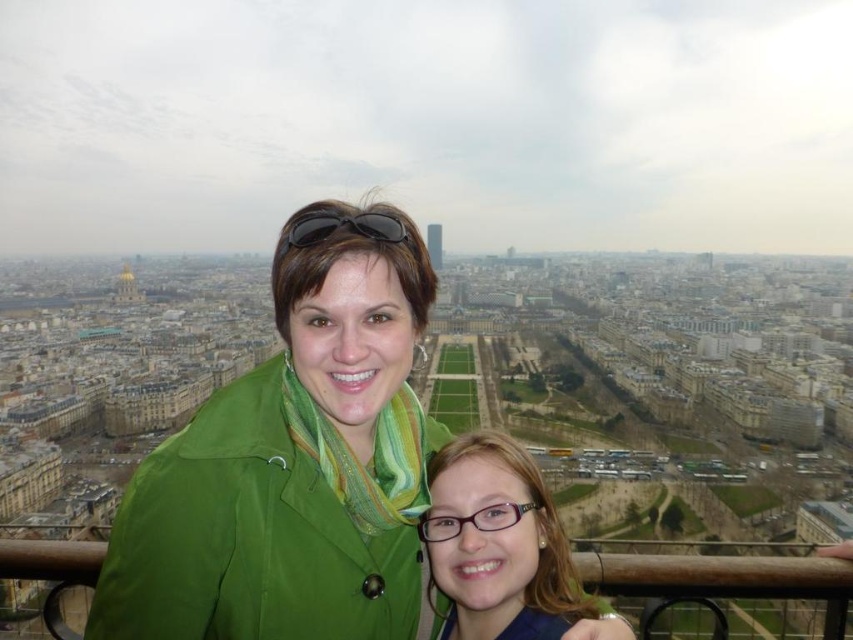
Question: Is green fabric jacket at center below black matte sunglasses at center?

Choices:
 (A) no
 (B) yes

Answer: (B)

Question: Among these objects, which one is farthest from the camera?

Choices:
 (A) black matte sunglasses at center
 (B) matte green jacket at center

Answer: (A)

Question: Which of the following is the farthest from the observer?

Choices:
 (A) (314, 241)
 (B) (392, 458)

Answer: (B)

Question: Which object is the farthest from the black matte sunglasses at center?

Choices:
 (A) matte green jacket at center
 (B) green fabric jacket at center

Answer: (A)

Question: Where is green fabric jacket at center located in relation to black matte sunglasses at center in the image?

Choices:
 (A) below
 (B) above

Answer: (A)

Question: Does green fabric jacket at center have a greater width compared to black matte sunglasses at center?

Choices:
 (A) yes
 (B) no

Answer: (A)